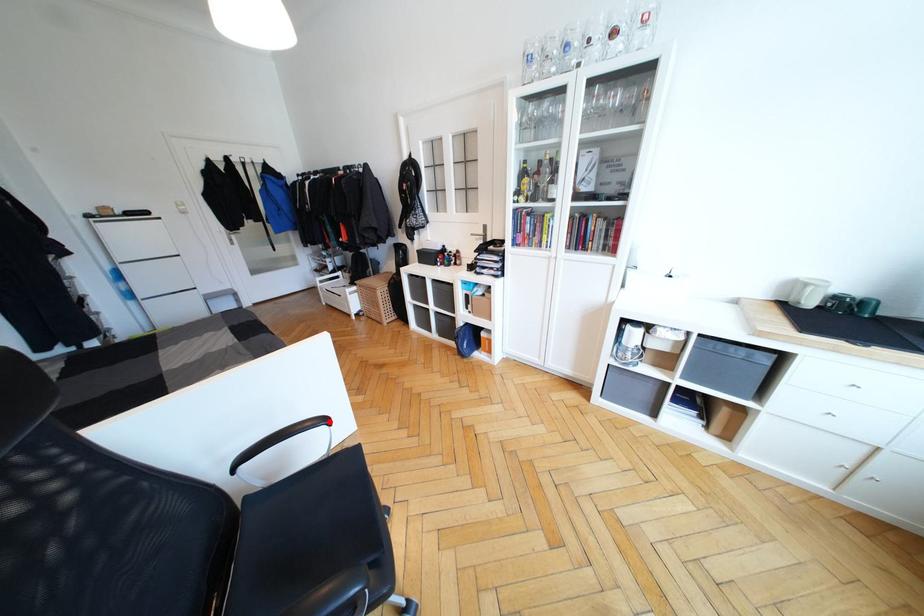
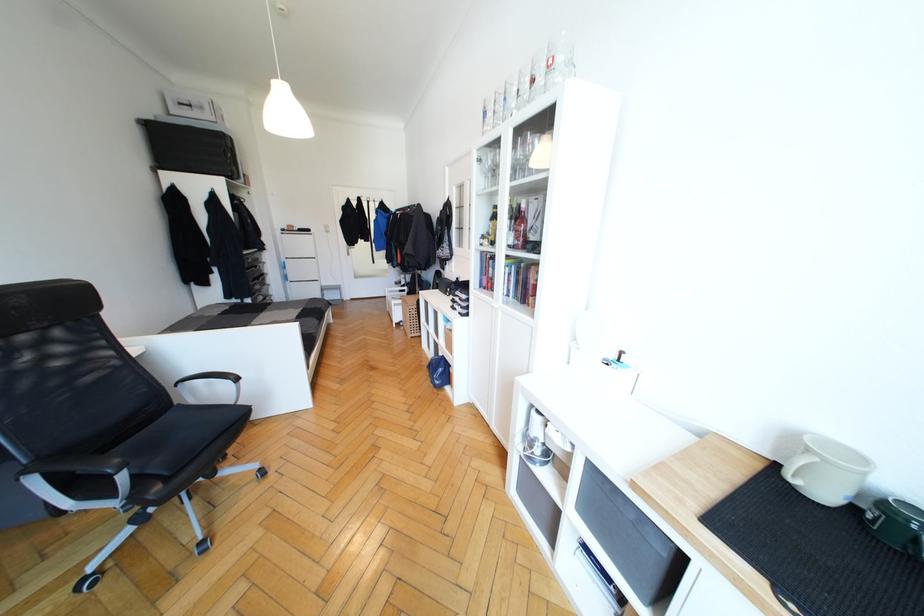
Question: I am providing you with two images of the same scene from different viewpoints. Image1 has a red point marked. In image2, the corresponding 3D location appears at what relative position? Reply with the corresponding letter.

Choices:
 (A) Closer
 (B) Farther

Answer: (B)